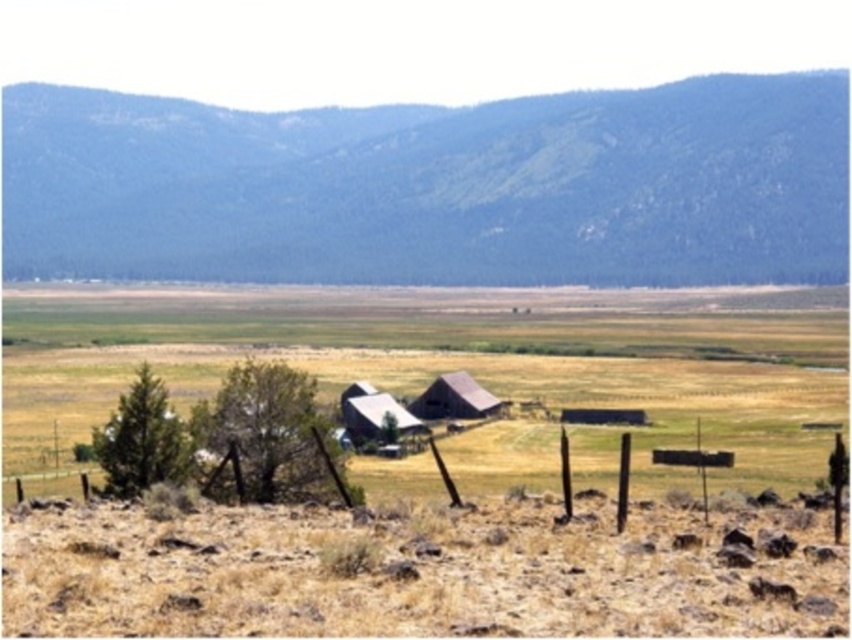
Does wooden barn at center have a lesser width compared to brown canvas tent at center?

Indeed, wooden barn at center has a lesser width compared to brown canvas tent at center.

Does point (426, 426) lie in front of point (471, 406)?

Yes.

At what (x,y) coordinates should I click in order to perform the action: click on wooden barn at center. Please return your answer as a coordinate pair (x, y). The height and width of the screenshot is (640, 852). Looking at the image, I should click on (373, 413).

Which is below, green textured mountain at upper center or brown canvas tent at center?

brown canvas tent at center

Between green textured mountain at upper center and brown canvas tent at center, which one appears on the left side from the viewer's perspective?

Positioned to the left is green textured mountain at upper center.

Who is more forward, (475, 148) or (462, 372)?

Positioned in front is point (462, 372).

Image resolution: width=852 pixels, height=640 pixels. What are the coordinates of `green textured mountain at upper center` in the screenshot? It's located at (471, 193).

Is green textured mountain at upper center further to the viewer compared to wooden barn at center?

Yes, it is.

Is green textured mountain at upper center wider than wooden barn at center?

Yes.

Is point (429, 272) behind point (353, 417)?

Yes, point (429, 272) is behind point (353, 417).

Identify the location of green textured mountain at upper center. The image size is (852, 640). (471, 193).